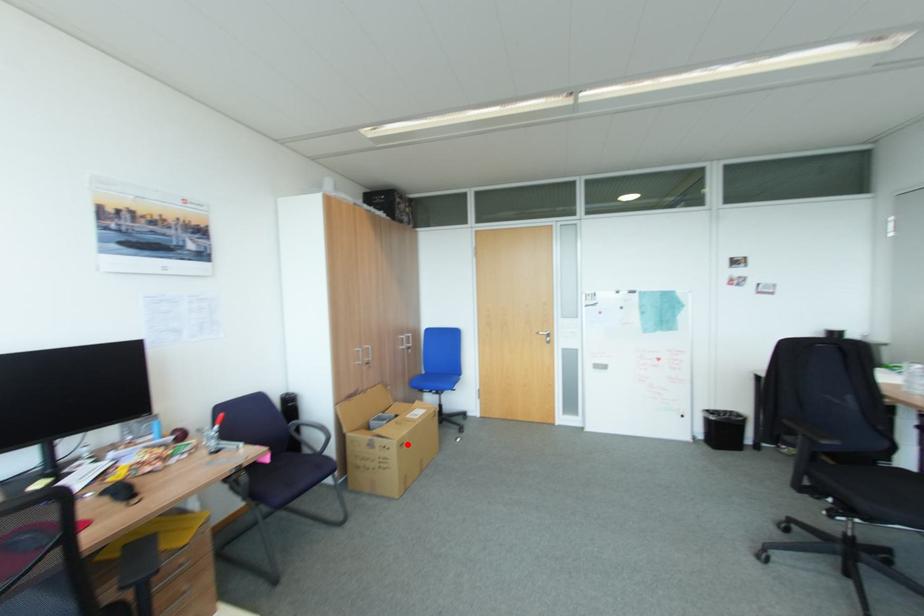
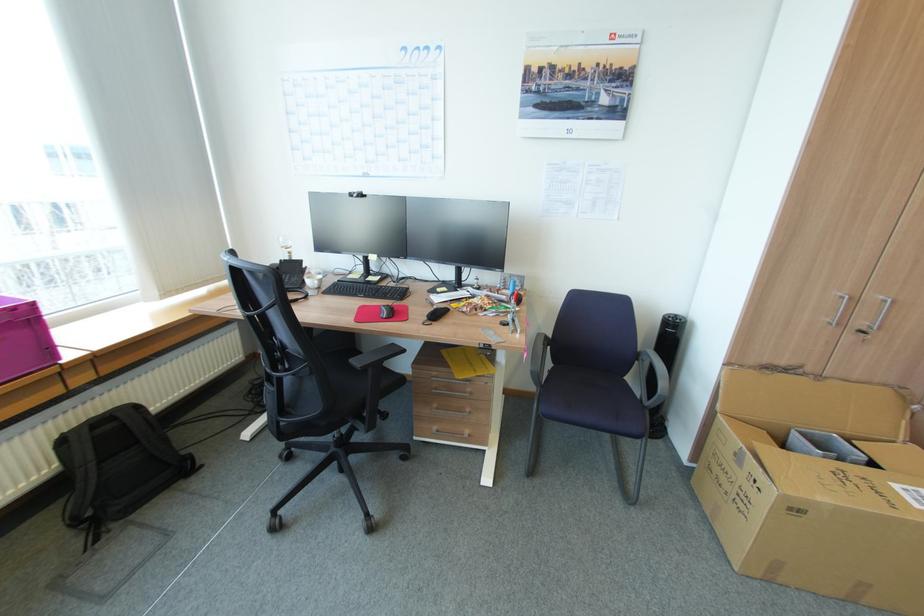
Question: I am providing you with two images of the same scene from different viewpoints. In image1, a red point is highlighted. Considering the same 3D point in image2, which of the following is correct?

Choices:
 (A) It is closer
 (B) It is farther

Answer: (A)